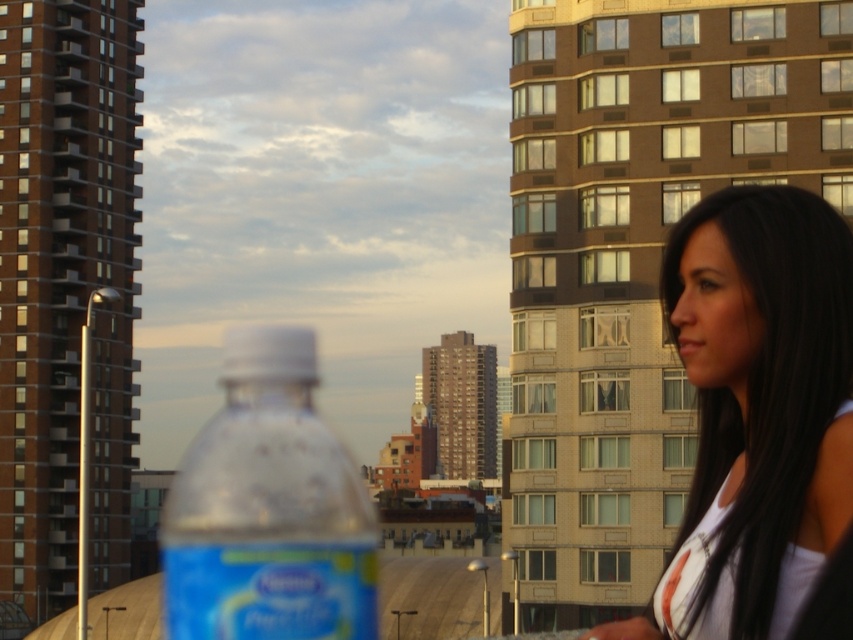
Between smooth white tank top at right and translucent plastic bottle at center, which one is positioned higher?

smooth white tank top at right is higher up.

Is smooth white tank top at right further to camera compared to translucent plastic bottle at center?

That is False.

The width and height of the screenshot is (853, 640). Describe the element at coordinates (763, 396) in the screenshot. I see `smooth white tank top at right` at that location.

Where is `smooth white tank top at right`? smooth white tank top at right is located at coordinates (763, 396).